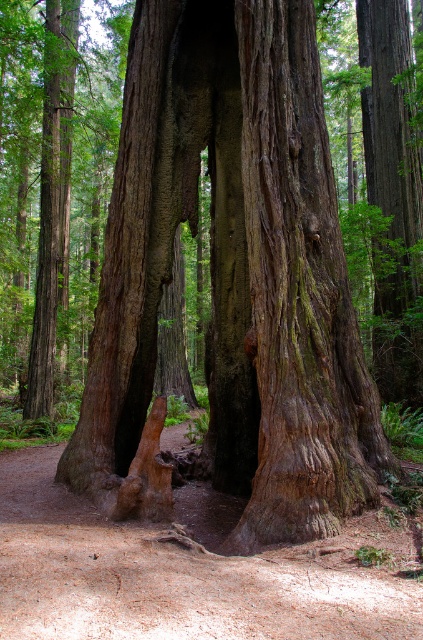
Question: Can you confirm if green mossy bark tree trunk at center is positioned above brown dirt trail at center?

Choices:
 (A) yes
 (B) no

Answer: (A)

Question: Where is green mossy bark tree trunk at center located in relation to smooth brown bark at center in the image?

Choices:
 (A) left
 (B) right

Answer: (B)

Question: Which of the following is the farthest from the observer?

Choices:
 (A) (253, 572)
 (B) (107, 426)

Answer: (B)

Question: Considering the relative positions of green mossy bark tree trunk at center and smooth brown bark at center in the image provided, where is green mossy bark tree trunk at center located with respect to smooth brown bark at center?

Choices:
 (A) below
 (B) above

Answer: (A)

Question: Which object is farther from the camera taking this photo?

Choices:
 (A) green mossy bark tree trunk at center
 (B) brown dirt trail at center
 (C) smooth brown bark at center

Answer: (C)

Question: Which object is closer to the camera taking this photo?

Choices:
 (A) brown dirt trail at center
 (B) smooth brown bark at center
 (C) green mossy bark tree trunk at center

Answer: (A)